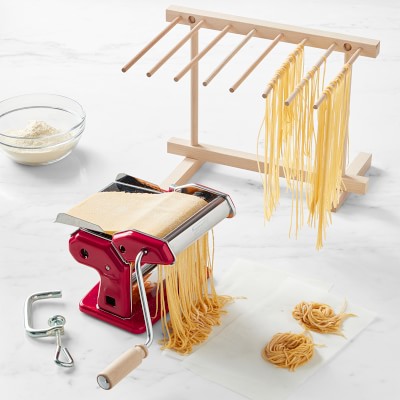
Identify the location of napkin. The image size is (400, 400). (253, 337).